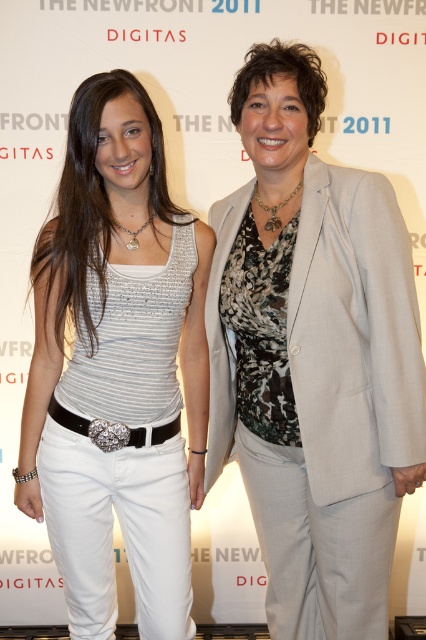
Question: Which object appears closest to the camera in this image?

Choices:
 (A) light gray fabric business suit at center
 (B) white matte pants at left

Answer: (A)

Question: Among these objects, which one is farthest from the camera?

Choices:
 (A) light gray fabric business suit at center
 (B) white matte pants at left

Answer: (B)

Question: Does white matte pants at left have a larger size compared to light gray fabric business suit at center?

Choices:
 (A) yes
 (B) no

Answer: (A)

Question: Is white matte pants at left smaller than light gray fabric business suit at center?

Choices:
 (A) yes
 (B) no

Answer: (B)

Question: Is white matte pants at left below light gray fabric business suit at center?

Choices:
 (A) yes
 (B) no

Answer: (A)